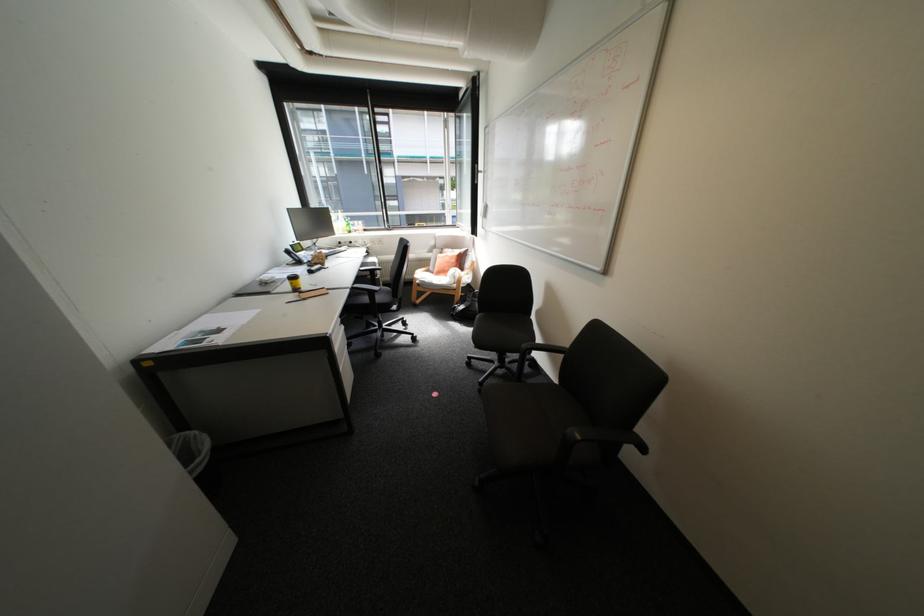
In order to click on yellow coffee cup in this screenshot , I will do `click(294, 282)`.